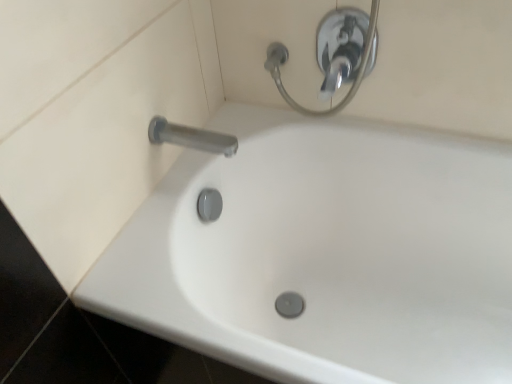
Question: Does white glossy bathtub at center have a greater height compared to chrome metallic shower handle at upper center?

Choices:
 (A) yes
 (B) no

Answer: (A)

Question: Is white glossy bathtub at center turned away from chrome metallic shower handle at upper center?

Choices:
 (A) yes
 (B) no

Answer: (B)

Question: Is white glossy bathtub at center with chrome metallic shower handle at upper center?

Choices:
 (A) yes
 (B) no

Answer: (B)

Question: Does white glossy bathtub at center have a greater width compared to chrome metallic shower handle at upper center?

Choices:
 (A) yes
 (B) no

Answer: (A)

Question: Does white glossy bathtub at center have a lesser height compared to chrome metallic shower handle at upper center?

Choices:
 (A) yes
 (B) no

Answer: (B)

Question: From a real-world perspective, is white glossy bathtub at center located beneath chrome metallic shower handle at upper center?

Choices:
 (A) no
 (B) yes

Answer: (B)

Question: Is the surface of satin nickel faucet at upper left in direct contact with white glossy bathtub at center?

Choices:
 (A) yes
 (B) no

Answer: (B)

Question: Considering the relative sizes of satin nickel faucet at upper left and white glossy bathtub at center in the image provided, is satin nickel faucet at upper left shorter than white glossy bathtub at center?

Choices:
 (A) yes
 (B) no

Answer: (A)

Question: From the image's perspective, is satin nickel faucet at upper left above white glossy bathtub at center?

Choices:
 (A) no
 (B) yes

Answer: (B)

Question: Does satin nickel faucet at upper left have a greater width compared to white glossy bathtub at center?

Choices:
 (A) no
 (B) yes

Answer: (A)

Question: Does satin nickel faucet at upper left have a greater height compared to white glossy bathtub at center?

Choices:
 (A) no
 (B) yes

Answer: (A)

Question: Can you confirm if satin nickel faucet at upper left is thinner than white glossy bathtub at center?

Choices:
 (A) no
 (B) yes

Answer: (B)

Question: Is chrome metallic shower handle at upper center bigger than white glossy bathtub at center?

Choices:
 (A) yes
 (B) no

Answer: (B)